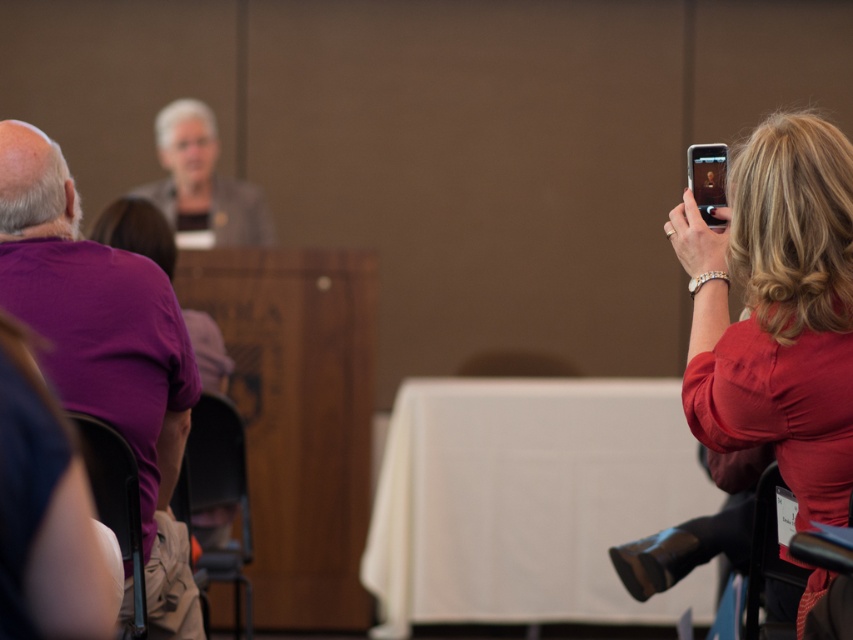
Question: Does matte red shirt at right have a larger size compared to purple cotton shirt at left?

Choices:
 (A) yes
 (B) no

Answer: (A)

Question: Can you confirm if matte red shirt at right is wider than purple cotton shirt at left?

Choices:
 (A) no
 (B) yes

Answer: (A)

Question: Estimate the real-world distances between objects in this image. Which object is closer to the matte gray blazer at center?

Choices:
 (A) matte red shirt at right
 (B) purple cotton shirt at left

Answer: (B)

Question: Which object is farther from the camera taking this photo?

Choices:
 (A) matte gray blazer at center
 (B) matte red shirt at right

Answer: (A)

Question: Where is matte red shirt at right located in relation to matte gray blazer at center in the image?

Choices:
 (A) above
 (B) below

Answer: (B)

Question: Which object is positioned farthest from the matte gray blazer at center?

Choices:
 (A) purple cotton shirt at left
 (B) matte red shirt at right

Answer: (B)